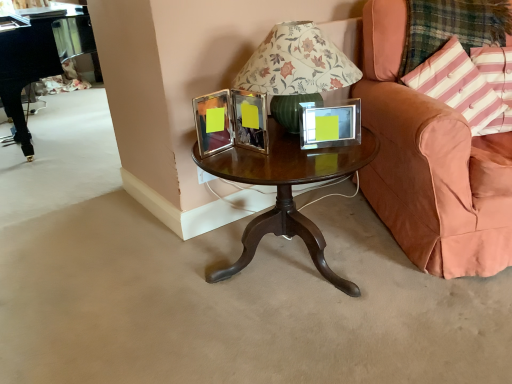
Question: From the image's perspective, is clear glass picture frame at center above or below plaid fabric at right?

Choices:
 (A) above
 (B) below

Answer: (B)

Question: From a real-world perspective, is clear glass picture frame at center physically located above or below plaid fabric at right?

Choices:
 (A) below
 (B) above

Answer: (A)

Question: Which of these objects is positioned farthest from the mahogany wood coffee table at center?

Choices:
 (A) clear glass picture frame at center
 (B) black polished piano at left
 (C) peach velvet chair at right
 (D) plaid fabric at right
 (E) pink striped fabric pillow at upper right, the first pillow from the left

Answer: (B)

Question: Based on their relative distances, which object is farther from the mahogany wood coffee table at center?

Choices:
 (A) peach velvet chair at right
 (B) pink striped fabric pillow at right, which is counted as the first pillow, starting from the right
 (C) clear glass picture frame at center
 (D) black polished piano at left
 (E) pink striped fabric pillow at upper right, the first pillow from the left

Answer: (D)